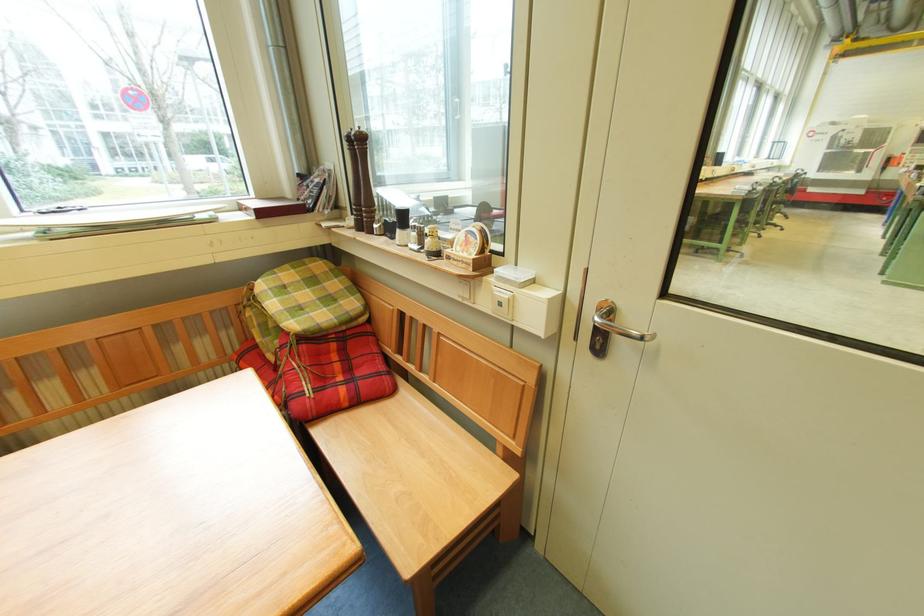
Where would you lift the small porcelain shaker? Please return your answer as a coordinate pair (x, y).

(417, 237)